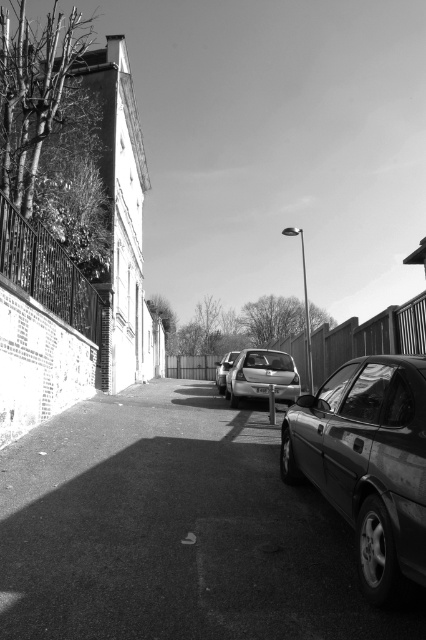
Question: Which of the following is the closest to the observer?

Choices:
 (A) (247, 538)
 (B) (221, 385)
 (C) (244, 397)
 (D) (391, 449)

Answer: (D)

Question: Which point is farther to the camera?

Choices:
 (A) (264, 390)
 (B) (411, 420)

Answer: (A)

Question: Is shiny metallic car at right below metallic silver car at center?

Choices:
 (A) no
 (B) yes

Answer: (B)

Question: Can you confirm if metallic silver car at center is wider than silver metallic car at center?

Choices:
 (A) yes
 (B) no

Answer: (A)

Question: Is the position of smooth asphalt road at center less distant than that of shiny metallic car at right?

Choices:
 (A) yes
 (B) no

Answer: (B)

Question: Which of the following is the farthest from the observer?

Choices:
 (A) (227, 368)
 (B) (227, 420)

Answer: (A)